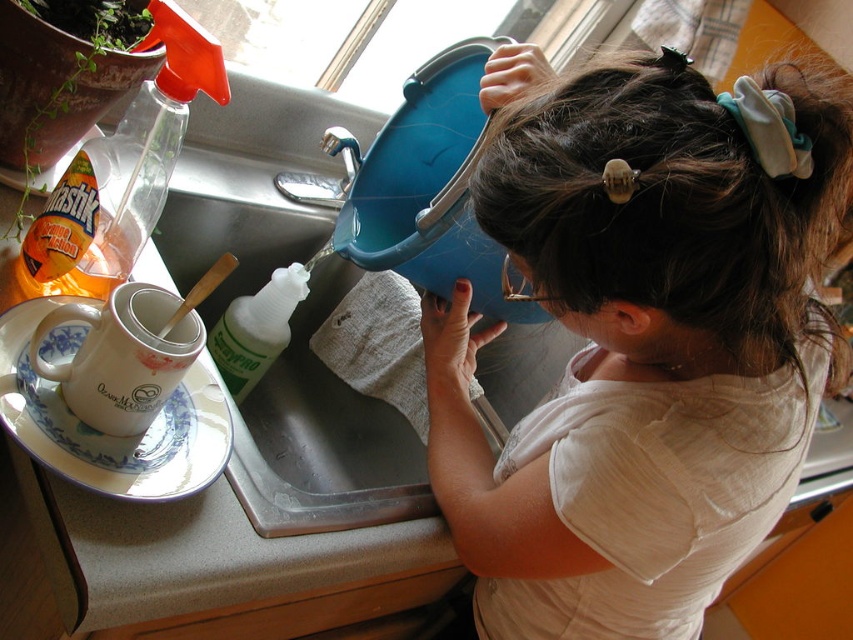
Question: Can you confirm if light brown hair at upper right is bigger than white ceramic plate at upper left?

Choices:
 (A) no
 (B) yes

Answer: (B)

Question: Where is light brown hair at upper right located in relation to white ceramic plate at upper left in the image?

Choices:
 (A) below
 (B) above

Answer: (A)

Question: Among these objects, which one is nearest to the camera?

Choices:
 (A) white ceramic plate at upper left
 (B) light brown hair at upper right

Answer: (B)

Question: Is light brown hair at upper right to the left of white ceramic plate at upper left from the viewer's perspective?

Choices:
 (A) no
 (B) yes

Answer: (A)